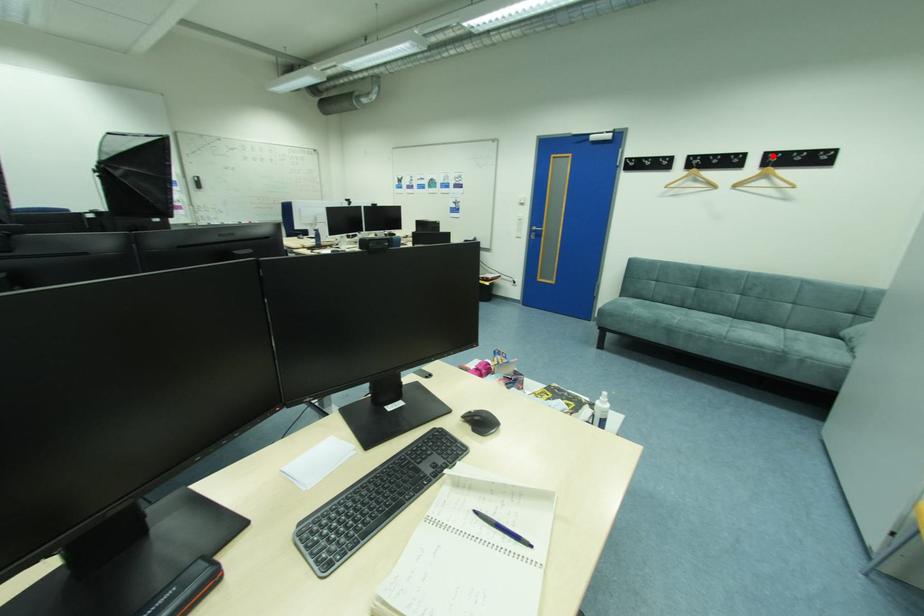
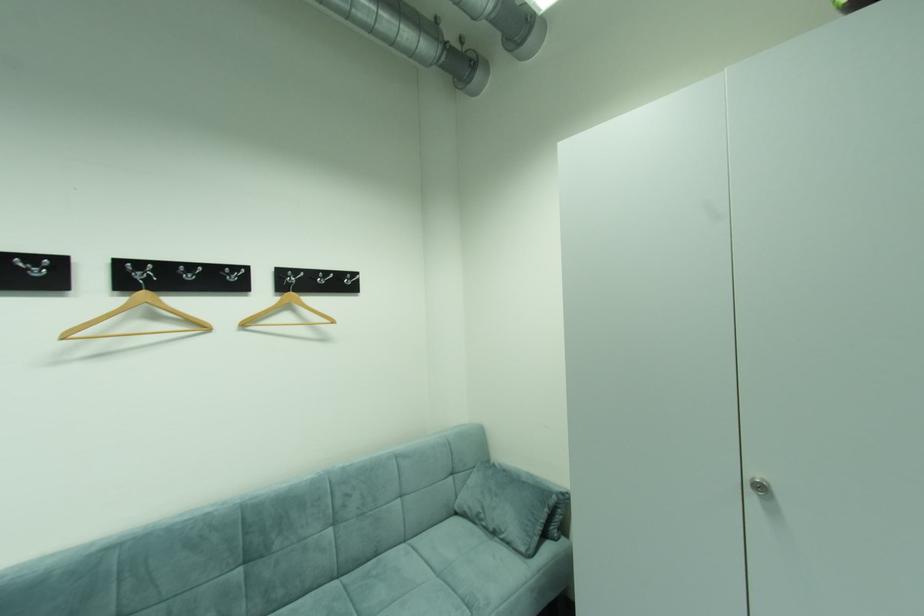
In the second image, find the point that corresponds to the highlighted location in the first image.

(286, 274)